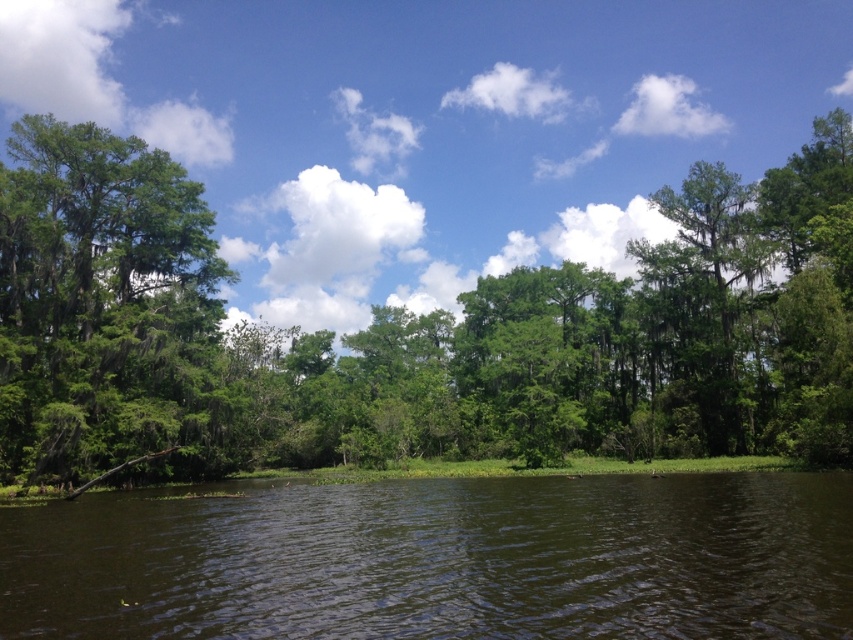
Question: Which object appears closest to the camera in this image?

Choices:
 (A) green mossy tree at left
 (B) green leafy forest at center
 (C) green grass at lower center

Answer: (C)

Question: Is green grass at lower center bigger than green mossy tree at left?

Choices:
 (A) no
 (B) yes

Answer: (A)

Question: Which point appears closest to the camera in this image?

Choices:
 (A) (155, 177)
 (B) (294, 400)
 (C) (178, 611)

Answer: (C)

Question: Can you confirm if green leafy forest at center is positioned to the right of green mossy tree at left?

Choices:
 (A) no
 (B) yes

Answer: (B)

Question: Which point is closer to the camera?

Choices:
 (A) green leafy forest at center
 (B) green grass at lower center
 (C) green mossy tree at left

Answer: (B)

Question: Does green leafy forest at center have a larger size compared to green grass at lower center?

Choices:
 (A) yes
 (B) no

Answer: (A)